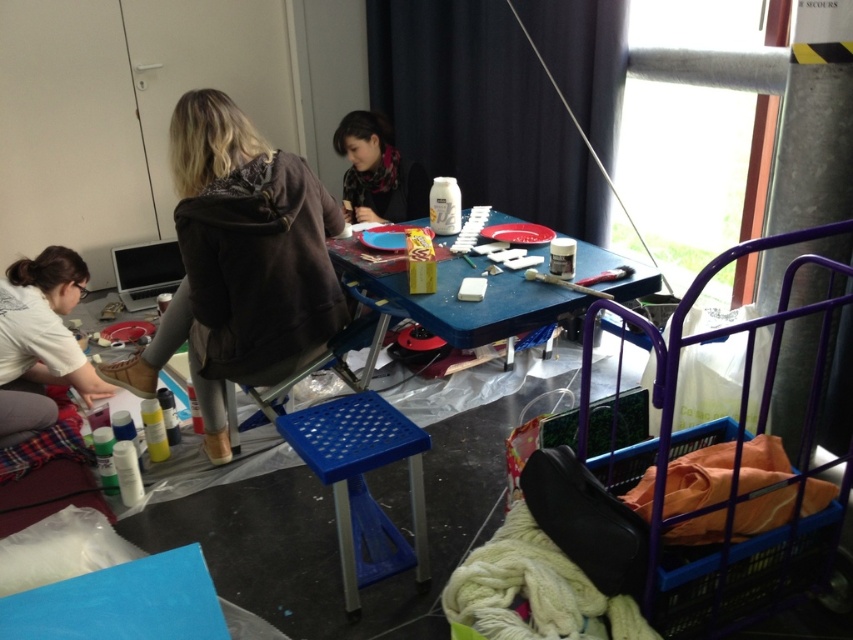
Does point (45, 317) lie in front of point (299, 371)?

No, (45, 317) is further to viewer.

Who is lower down, white matte shirt at lower left or blue plastic chair at center?

blue plastic chair at center is lower down.

Describe the element at coordinates (41, 339) in the screenshot. Image resolution: width=853 pixels, height=640 pixels. I see `white matte shirt at lower left` at that location.

Identify the location of white matte shirt at lower left. The width and height of the screenshot is (853, 640). (41, 339).

Between blue plastic stool at center and blue plastic chair at center, which one appears on the left side from the viewer's perspective?

Positioned to the left is blue plastic chair at center.

Is blue plastic stool at center bigger than blue plastic chair at center?

No, blue plastic stool at center is not bigger than blue plastic chair at center.

You are a GUI agent. You are given a task and a screenshot of the screen. Output one action in this format:
    pyautogui.click(x=<x>, y=<y>)
    Task: Click on the blue plastic stool at center
    This screenshot has height=640, width=853.
    Given the screenshot: What is the action you would take?
    pyautogui.click(x=363, y=481)

Can you confirm if brown suede jacket at upper left is wider than blue plastic stool at center?

Correct, the width of brown suede jacket at upper left exceeds that of blue plastic stool at center.

Does point (309, 212) come farther from viewer compared to point (395, 442)?

Yes, point (309, 212) is farther from viewer.

Find the location of a particular element. brown suede jacket at upper left is located at coordinates (239, 262).